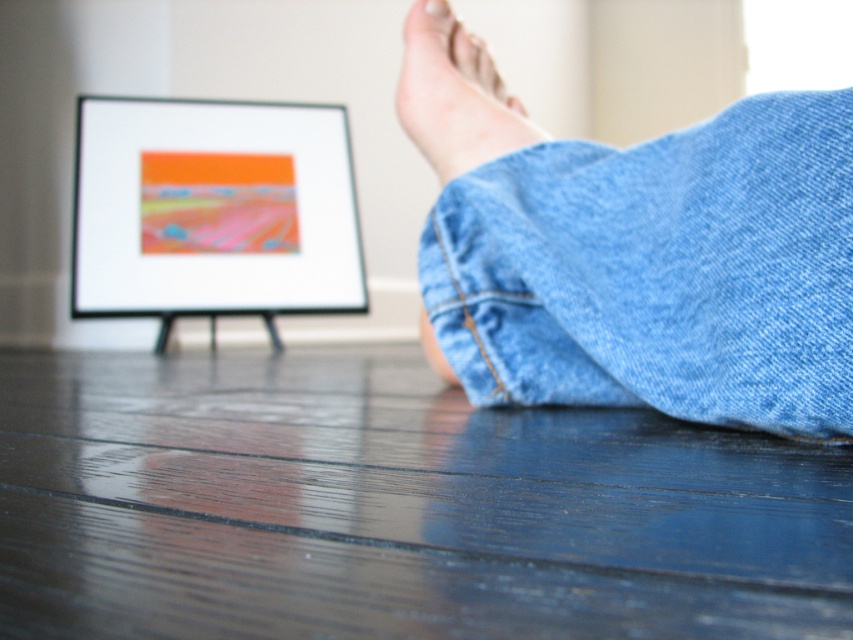
Between point (299, 262) and point (444, 168), which one is positioned in front?

Point (444, 168) is in front.

Who is more distant from viewer, (80, 211) or (466, 138)?

The point (80, 211) is more distant.

Between point (260, 301) and point (489, 147), which one is positioned in front?

Positioned in front is point (489, 147).

What are the coordinates of `matte black picture frame at upper center` in the screenshot? It's located at (213, 209).

Is denim at lower right thinner than smooth skin foot at center?

Incorrect, denim at lower right's width is not less than smooth skin foot at center's.

Locate an element on the screen. The image size is (853, 640). denim at lower right is located at coordinates (659, 272).

Between denim at lower right and matte black picture frame at upper center, which one appears on the right side from the viewer's perspective?

Positioned to the right is denim at lower right.

The width and height of the screenshot is (853, 640). Describe the element at coordinates (659, 272) in the screenshot. I see `denim at lower right` at that location.

You are a GUI agent. You are given a task and a screenshot of the screen. Output one action in this format:
    pyautogui.click(x=<x>, y=<y>)
    Task: Click on the denim at lower right
    The width and height of the screenshot is (853, 640).
    Given the screenshot: What is the action you would take?
    pyautogui.click(x=659, y=272)